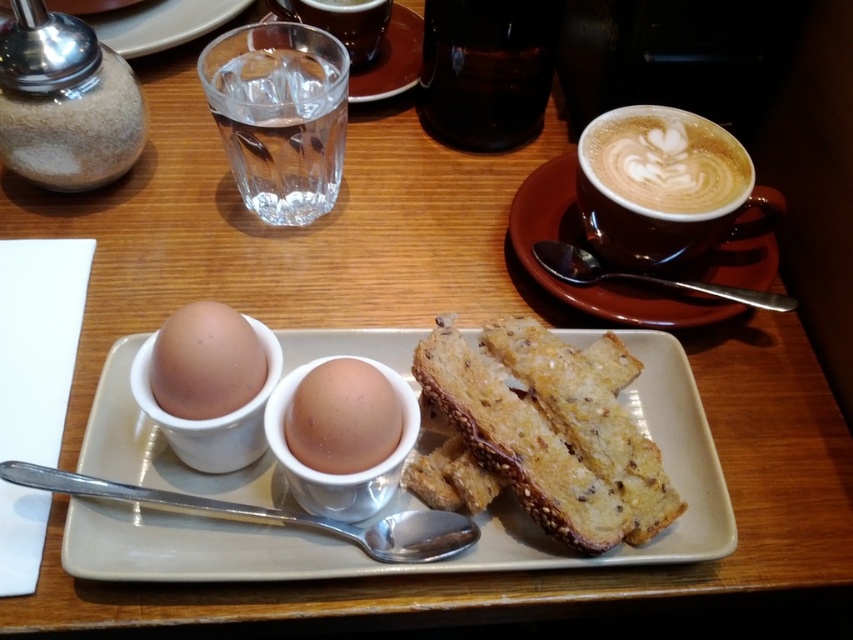
Is brown ceramic saucer at upper right to the left of brown matte egg at center-left from the viewer's perspective?

Incorrect, brown ceramic saucer at upper right is not on the left side of brown matte egg at center-left.

Is point (590, 250) positioned in front of point (178, 342)?

No, it is behind (178, 342).

Locate an element on the screen. The height and width of the screenshot is (640, 853). brown ceramic saucer at upper right is located at coordinates (595, 253).

Can you confirm if brown ceramic saucer at upper right is positioned to the left of latte art foam at upper right?

Yes, brown ceramic saucer at upper right is to the left of latte art foam at upper right.

Is point (590, 310) more distant than point (700, 168)?

No, (590, 310) is closer to viewer.

You are a GUI agent. You are given a task and a screenshot of the screen. Output one action in this format:
    pyautogui.click(x=<x>, y=<y>)
    Task: Click on the brown ceramic saucer at upper right
    The width and height of the screenshot is (853, 640).
    Given the screenshot: What is the action you would take?
    pyautogui.click(x=595, y=253)

Is golden brown toasted bread at center closer to the viewer compared to brown matte egg at center?

That is False.

The width and height of the screenshot is (853, 640). I want to click on golden brown toasted bread at center, so click(549, 433).